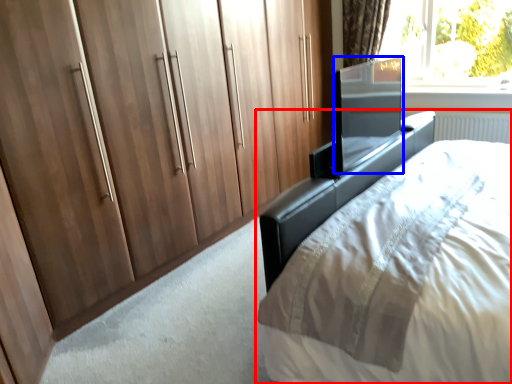
Question: Which object is further to the camera taking this photo, bed (highlighted by a red box) or screen door (highlighted by a blue box)?

Choices:
 (A) bed
 (B) screen door

Answer: (B)